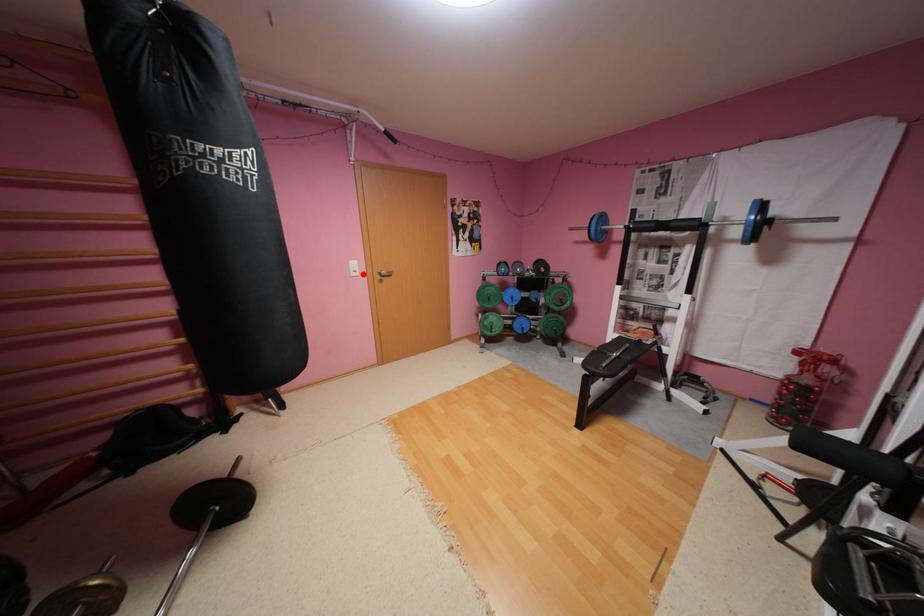
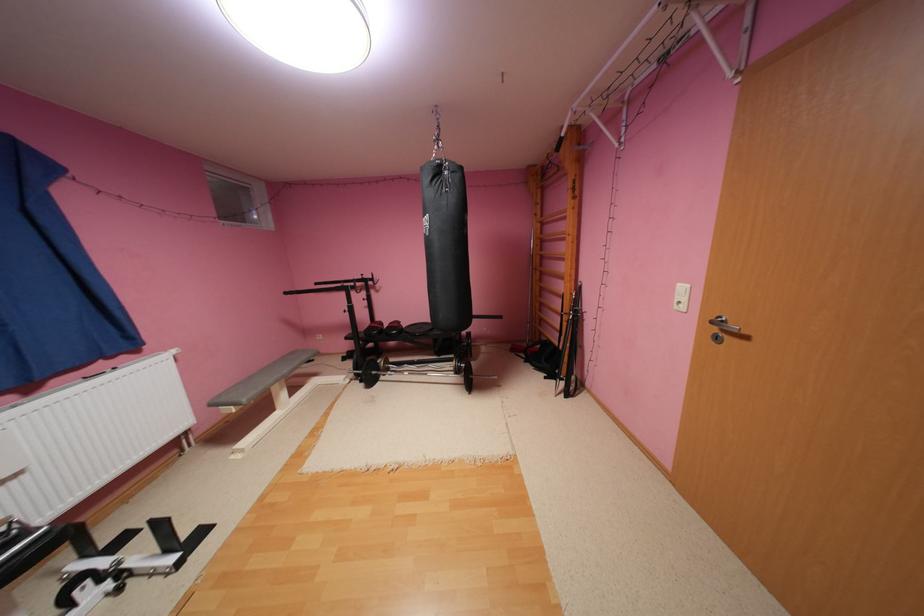
Find the pixel in the second image that matches the highlighted location in the first image.

(686, 306)